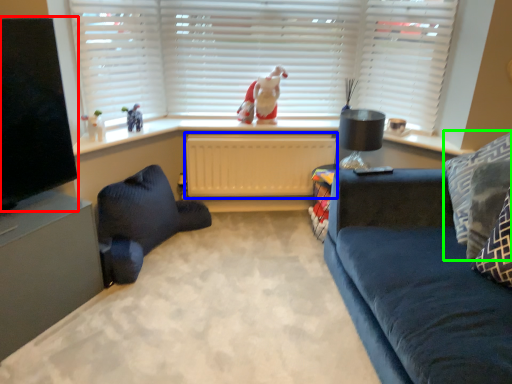
Question: Which object is positioned farthest from window screen (highlighted by a red box)? Select from radiator (highlighted by a blue box) and pillow (highlighted by a green box).

Choices:
 (A) radiator
 (B) pillow

Answer: (B)